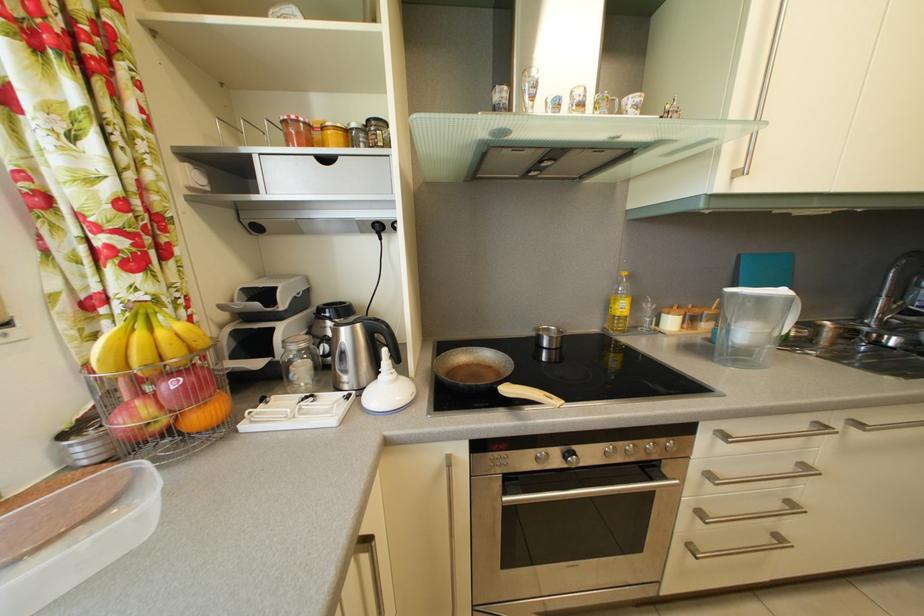
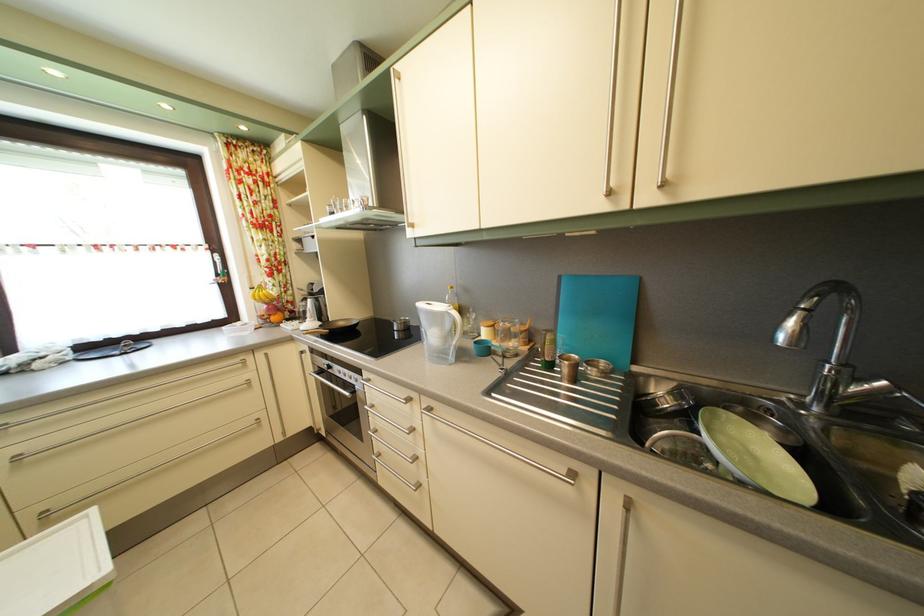
Question: I am providing you with two images of the same scene from different viewpoints. Please identify which objects are invisible in image2.

Choices:
 (A) oven door handle
 (B) faucet handle
 (C) clear glass bottle
 (D) none of these

Answer: (D)